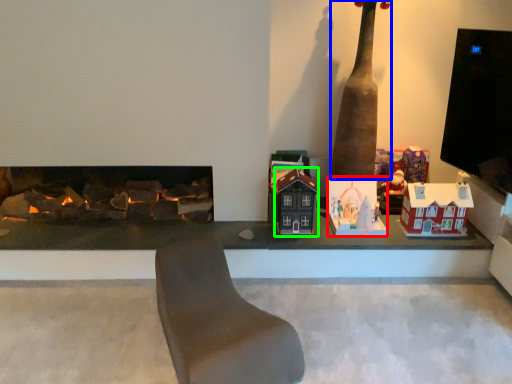
Question: Estimate the real-world distances between objects in this image. Which object is farther from toy (highlighted by a red box), totem pole (highlighted by a blue box) or toy (highlighted by a green box)?

Choices:
 (A) totem pole
 (B) toy

Answer: (A)